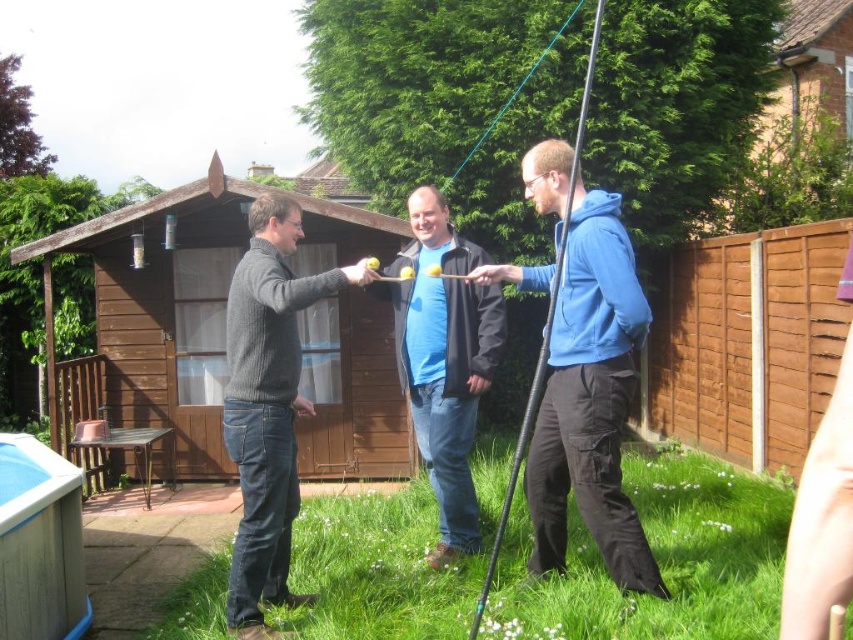
Question: Which object is farther from the camera taking this photo?

Choices:
 (A) brown wooden hut at center
 (B) blue matte shirt at center
 (C) knitted gray sweater at center
 (D) blue matte hoodie at center

Answer: (A)

Question: Does knitted gray sweater at center appear on the left side of blue matte shirt at center?

Choices:
 (A) yes
 (B) no

Answer: (A)

Question: Which of these objects is positioned farthest from the blue matte hoodie at center?

Choices:
 (A) knitted gray sweater at center
 (B) brown wooden hut at center

Answer: (B)

Question: From the image, what is the correct spatial relationship of brown wooden hut at center in relation to blue matte hoodie at center?

Choices:
 (A) above
 (B) below

Answer: (A)

Question: Which object is the farthest from the knitted gray sweater at center?

Choices:
 (A) blue matte shirt at center
 (B) blue matte hoodie at center

Answer: (B)

Question: Does brown wooden hut at center have a larger size compared to blue matte hoodie at center?

Choices:
 (A) no
 (B) yes

Answer: (B)